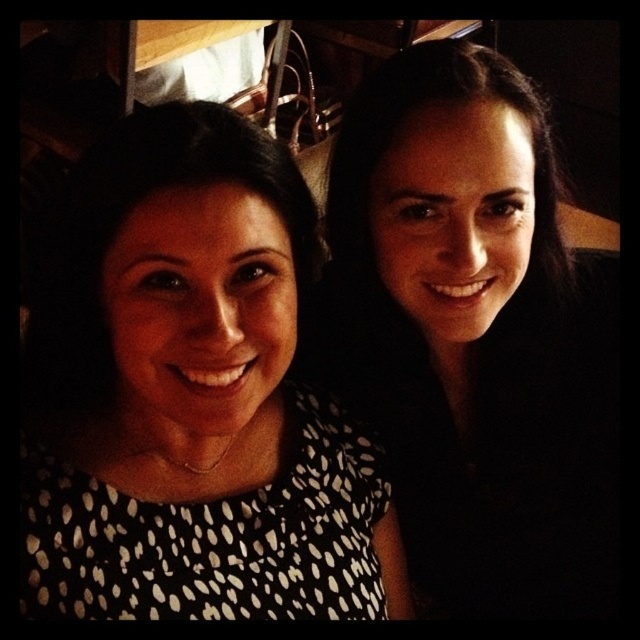
Question: Can you confirm if white dotted dress at center is smaller than black dotted dress at upper right?

Choices:
 (A) yes
 (B) no

Answer: (A)

Question: In this image, where is white dotted dress at center located relative to black dotted dress at upper right?

Choices:
 (A) right
 (B) left

Answer: (B)

Question: Among these objects, which one is farthest from the camera?

Choices:
 (A) white dotted dress at center
 (B) black dotted dress at upper right

Answer: (B)

Question: Does white dotted dress at center appear under black dotted dress at upper right?

Choices:
 (A) no
 (B) yes

Answer: (B)